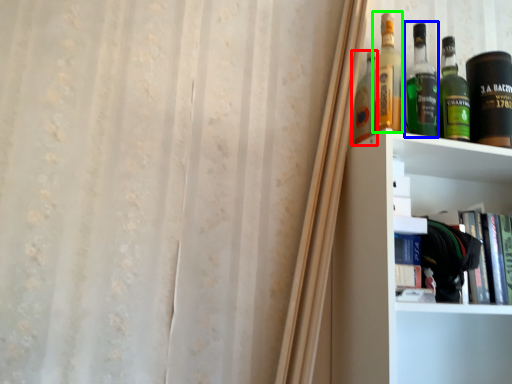
Question: Based on their relative distances, which object is farther from bottle (highlighted by a red box)? Choose from bottle (highlighted by a blue box) and bottle (highlighted by a green box).

Choices:
 (A) bottle
 (B) bottle

Answer: (A)